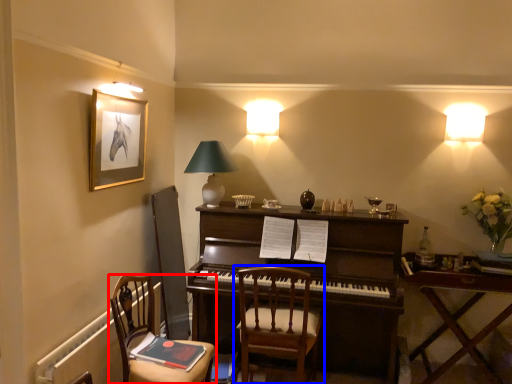
Question: Among these objects, which one is nearest to the camera, chair (highlighted by a red box) or chair (highlighted by a blue box)?

Choices:
 (A) chair
 (B) chair

Answer: (A)